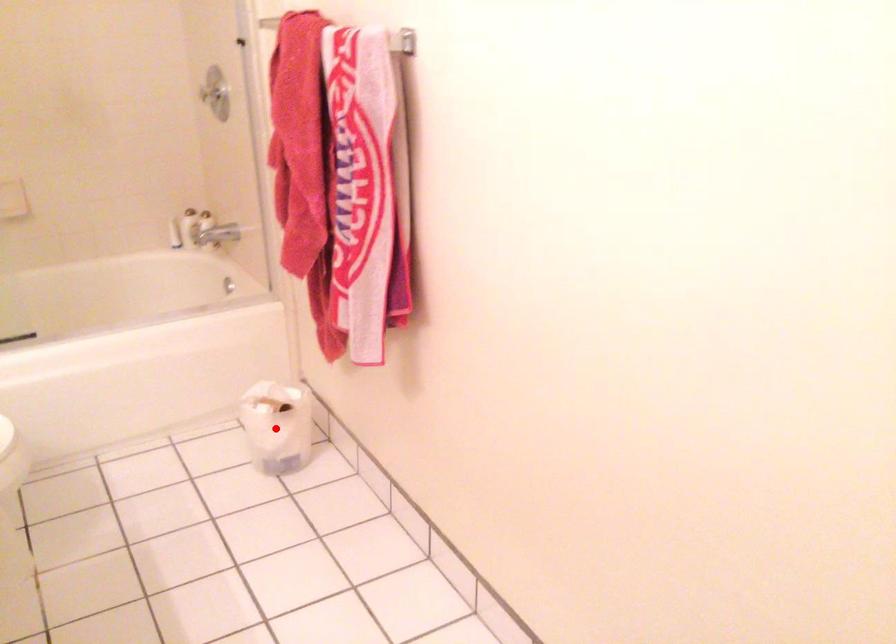
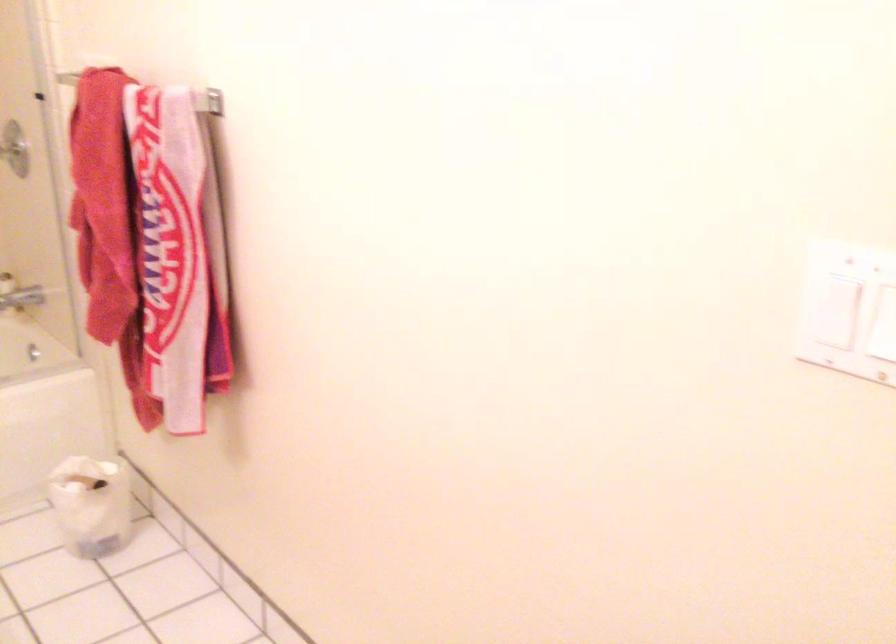
Where in the second image is the point corresponding to the highlighted location from the first image?

(90, 505)